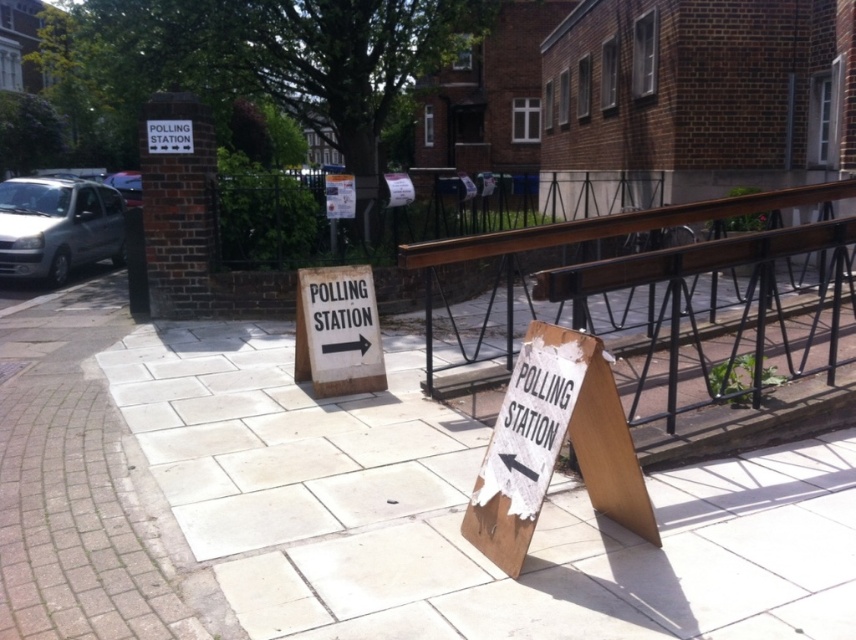
You are standing at the origin point of the image. Which direction should you walk to reach the wooden sign at lower right?

Since the wooden sign at lower right is located at coordinates point (554, 445), you should walk towards the lower right direction to reach it.

You are a voter trying to find the polling station. You see the white stone pavement at center and the white cardboard sign at center. Which one is wider?

The white cardboard sign at center is wider than the white stone pavement at center.

Consider the image. You are a voter trying to locate the polling station. You see a wooden sign at lower right and a white cardboard sign at center. Which sign is wider?

The wooden sign at lower right is wider than the white cardboard sign at center.